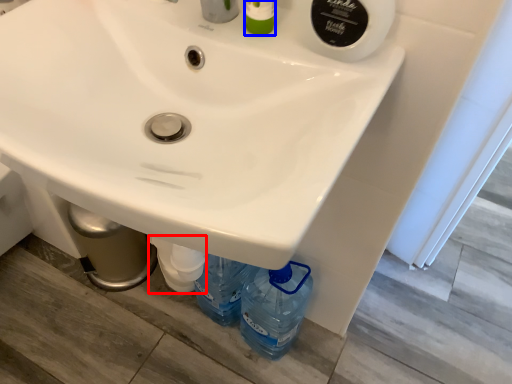
Question: Which point is closer to the camera, bottle (highlighted by a red box) or toiletry (highlighted by a blue box)?

Choices:
 (A) bottle
 (B) toiletry

Answer: (B)